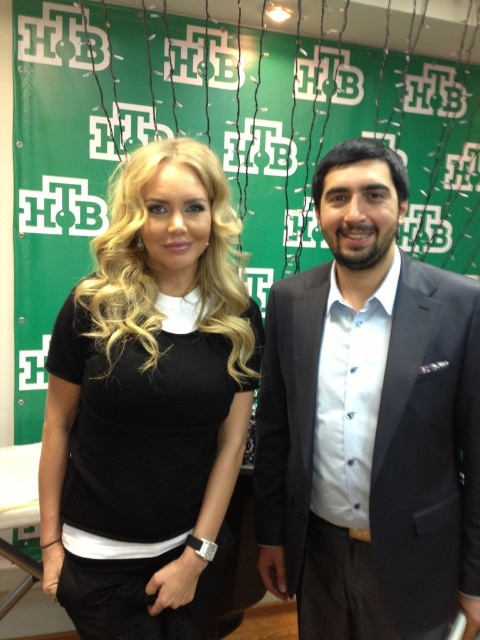
Looking at this image, between green fabric bulletin board at upper center and dark gray suit at center, which one is positioned lower?

dark gray suit at center is below.

Describe the element at coordinates (216, 141) in the screenshot. Image resolution: width=480 pixels, height=640 pixels. I see `green fabric bulletin board at upper center` at that location.

What are the coordinates of `green fabric bulletin board at upper center` in the screenshot? It's located at (216, 141).

The image size is (480, 640). What do you see at coordinates (216, 141) in the screenshot?
I see `green fabric bulletin board at upper center` at bounding box center [216, 141].

Based on the photo, measure the distance from green fabric bulletin board at upper center to black matte t-shirt at center.

green fabric bulletin board at upper center and black matte t-shirt at center are 1.35 meters apart.

Describe the element at coordinates (216, 141) in the screenshot. I see `green fabric bulletin board at upper center` at that location.

Locate an element on the screen. The width and height of the screenshot is (480, 640). green fabric bulletin board at upper center is located at coordinates (216, 141).

Who is positioned more to the right, dark gray suit at center or black matte t-shirt at center?

Positioned to the right is dark gray suit at center.

Is point (387, 205) less distant than point (95, 324)?

Yes.

At what (x,y) coordinates should I click in order to perform the action: click on dark gray suit at center. Please return your answer as a coordinate pair (x, y). The image size is (480, 640). Looking at the image, I should click on click(x=370, y=422).